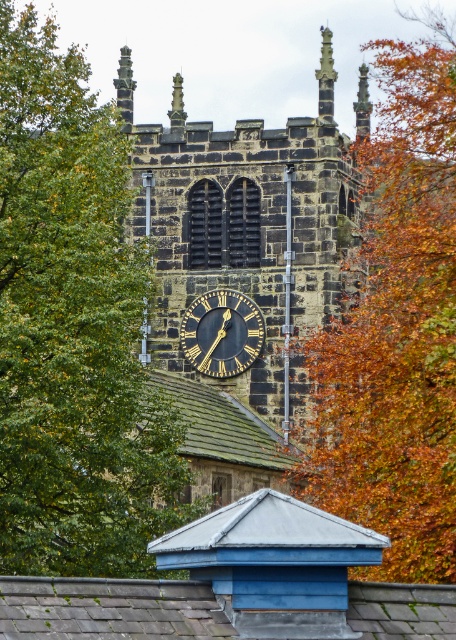
Question: Which of the following is the closest to the observer?

Choices:
 (A) black polished stone clock at center
 (B) green leafy tree at upper left

Answer: (B)

Question: Which of the following is the closest to the observer?

Choices:
 (A) black polished stone clock at center
 (B) orange leafy tree at right
 (C) green leafy tree at upper left

Answer: (C)

Question: Is green leafy tree at upper left closer to the viewer compared to orange leafy tree at right?

Choices:
 (A) no
 (B) yes

Answer: (B)

Question: Can you confirm if orange leafy tree at right is positioned to the right of polished stone spire at upper center?

Choices:
 (A) yes
 (B) no

Answer: (A)

Question: Does orange leafy tree at right appear on the left side of polished stone spire at upper center?

Choices:
 (A) yes
 (B) no

Answer: (B)

Question: Which of the following is the farthest from the observer?

Choices:
 (A) (320, 80)
 (B) (387, 269)
 (C) (129, 195)
 (D) (238, 312)

Answer: (B)